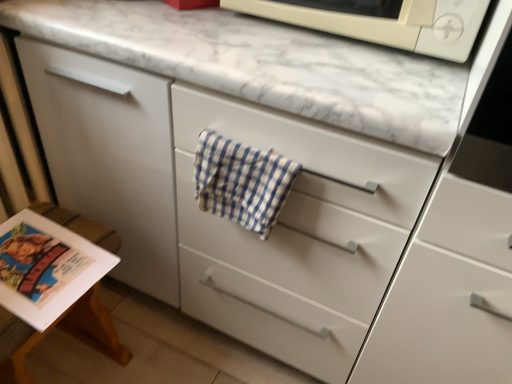
Question: From the image's perspective, is matte paper magazine at lower left below blue checkered towel at center?

Choices:
 (A) no
 (B) yes

Answer: (B)

Question: Does matte paper magazine at lower left have a smaller size compared to blue checkered towel at center?

Choices:
 (A) no
 (B) yes

Answer: (A)

Question: Is matte paper magazine at lower left positioned behind blue checkered towel at center?

Choices:
 (A) yes
 (B) no

Answer: (A)

Question: Is matte paper magazine at lower left taller than blue checkered towel at center?

Choices:
 (A) no
 (B) yes

Answer: (B)

Question: Does matte paper magazine at lower left contain blue checkered towel at center?

Choices:
 (A) yes
 (B) no

Answer: (B)

Question: Could you tell me if matte paper magazine at lower left is turned towards blue checkered towel at center?

Choices:
 (A) no
 (B) yes

Answer: (A)

Question: From the image's perspective, is blue checkered towel at center beneath matte paper magazine at lower left?

Choices:
 (A) yes
 (B) no

Answer: (B)

Question: Considering the relative sizes of blue checkered towel at center and matte paper magazine at lower left in the image provided, is blue checkered towel at center thinner than matte paper magazine at lower left?

Choices:
 (A) yes
 (B) no

Answer: (A)

Question: From the image's perspective, is blue checkered towel at center over matte paper magazine at lower left?

Choices:
 (A) yes
 (B) no

Answer: (A)

Question: Is blue checkered towel at center taller than matte paper magazine at lower left?

Choices:
 (A) no
 (B) yes

Answer: (A)

Question: Does blue checkered towel at center come in front of matte paper magazine at lower left?

Choices:
 (A) no
 (B) yes

Answer: (B)

Question: Can you confirm if blue checkered towel at center is bigger than matte paper magazine at lower left?

Choices:
 (A) yes
 (B) no

Answer: (B)

Question: Is white matte microwave at upper center closer to the viewer compared to matte paper magazine at lower left?

Choices:
 (A) no
 (B) yes

Answer: (B)